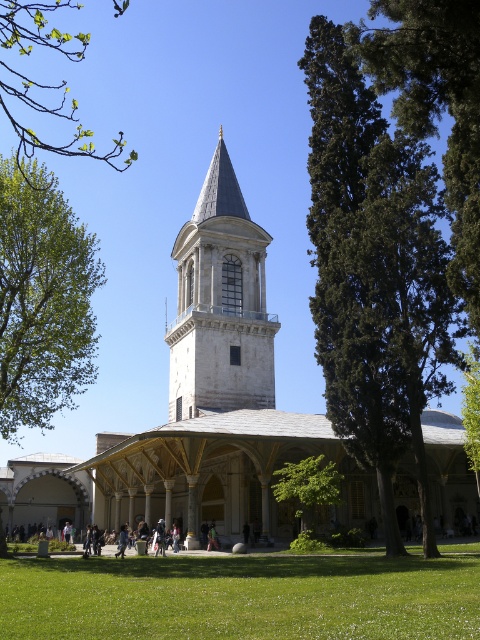
Is white stone tower at center wider than green leafy tree at lower right?

Yes, white stone tower at center is wider than green leafy tree at lower right.

Is point (452, 518) more distant than point (469, 426)?

Yes, point (452, 518) is farther from viewer.

Is point (160, 509) farther from viewer compared to point (471, 381)?

Yes.

I want to click on white stone tower at center, so click(202, 404).

Can you confirm if green leafy tree at left is wider than green leafy branch at upper left?

No, green leafy tree at left is not wider than green leafy branch at upper left.

Is point (92, 268) positioned in front of point (122, 8)?

Yes.

This screenshot has width=480, height=640. In order to click on green leafy tree at left in this screenshot , I will do `click(43, 298)`.

This screenshot has width=480, height=640. In order to click on green leafy tree at left in this screenshot , I will do `click(43, 298)`.

Can you confirm if green leafy tree at lower center is positioned to the right of green leafy tree at lower right?

Incorrect, green leafy tree at lower center is not on the right side of green leafy tree at lower right.

Which is in front, point (276, 496) or point (465, 412)?

Point (276, 496) is in front.

You are a GUI agent. You are given a task and a screenshot of the screen. Output one action in this format:
    pyautogui.click(x=<x>, y=<y>)
    Task: Click on the green leafy tree at lower center
    Image resolution: width=480 pixels, height=640 pixels.
    Given the screenshot: What is the action you would take?
    pyautogui.click(x=308, y=486)